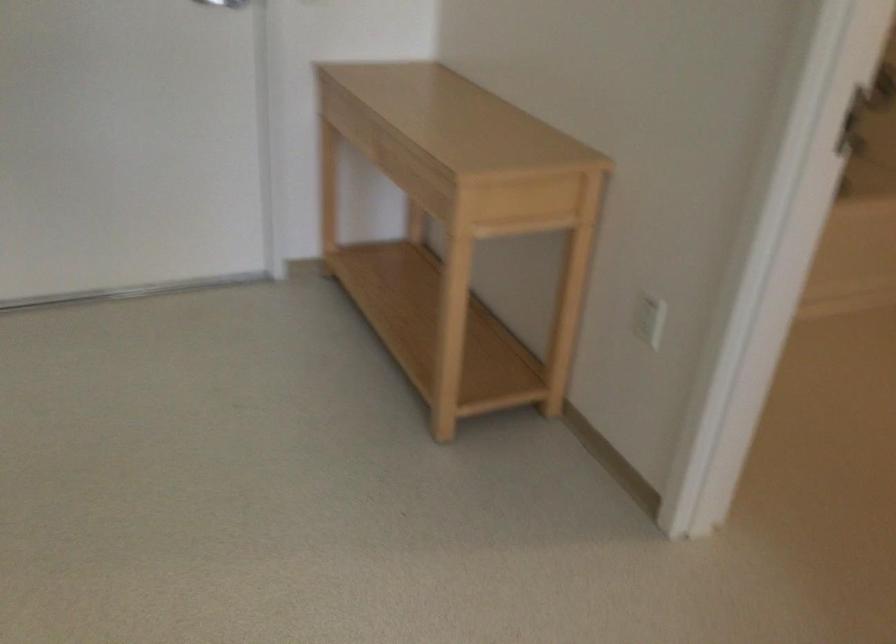
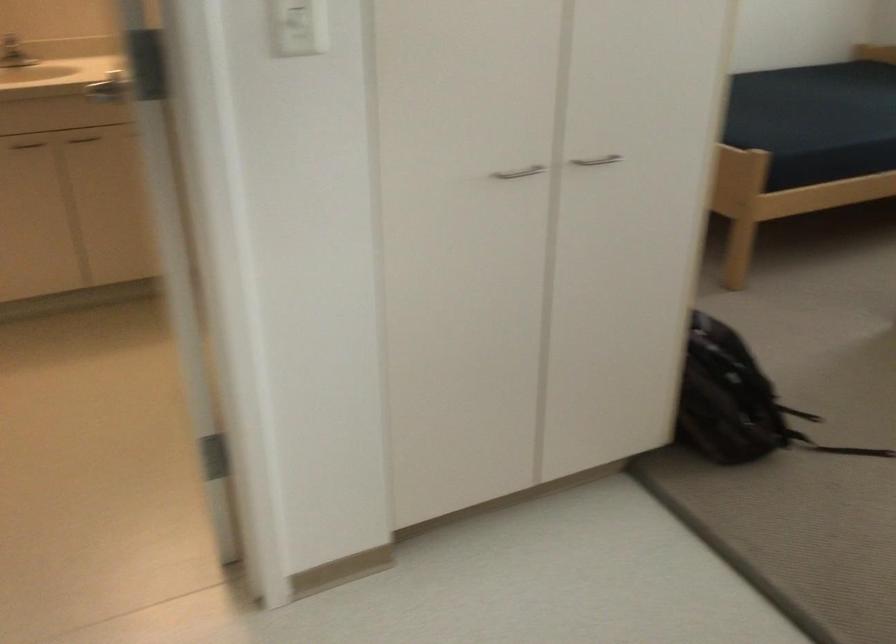
Consider the image. First-person continuous shooting, in which direction is the camera rotating?

The camera's rotation is toward right-down.